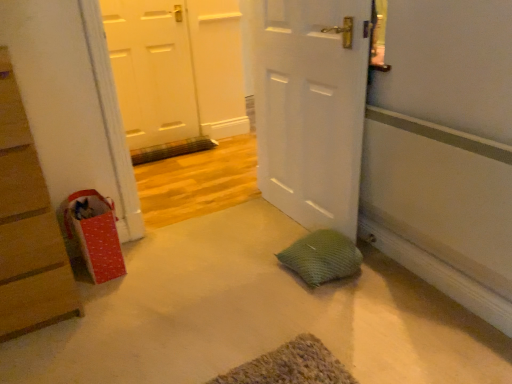
Where is `free location in front of red dotted paper bag at left`? The width and height of the screenshot is (512, 384). free location in front of red dotted paper bag at left is located at coordinates (97, 294).